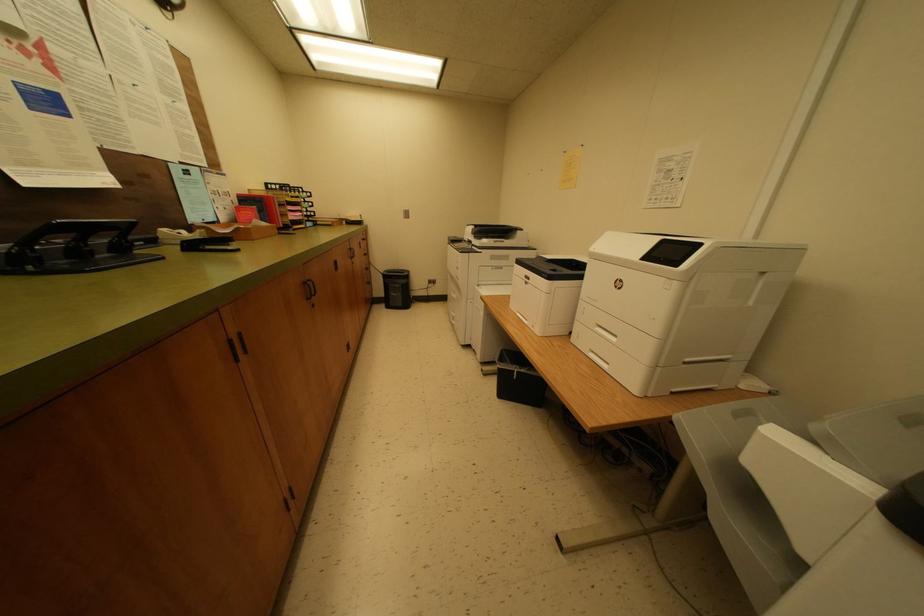
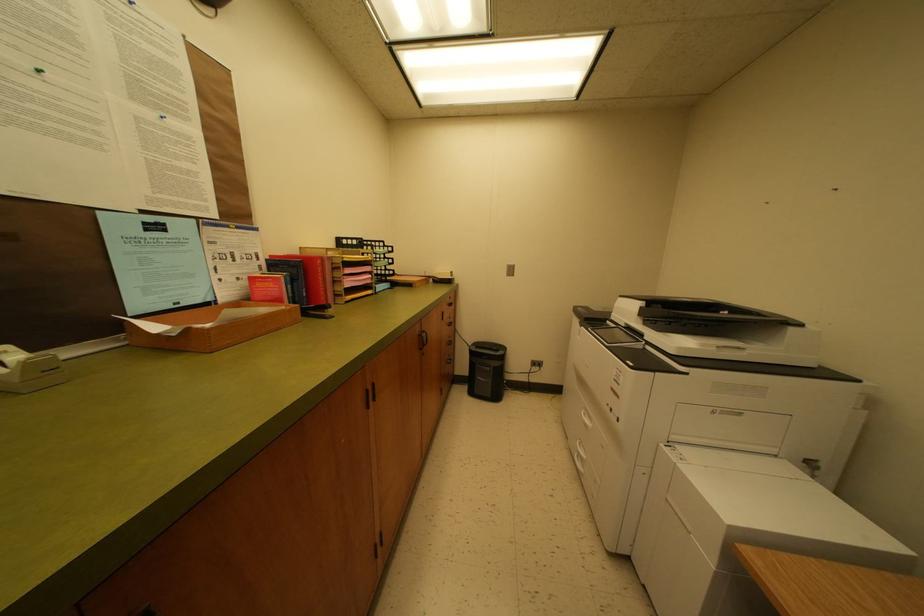
Question: What movement of the cameraman would produce the second image?

Choices:
 (A) Left
 (B) Right
 (C) Forward
 (D) Backward

Answer: (C)